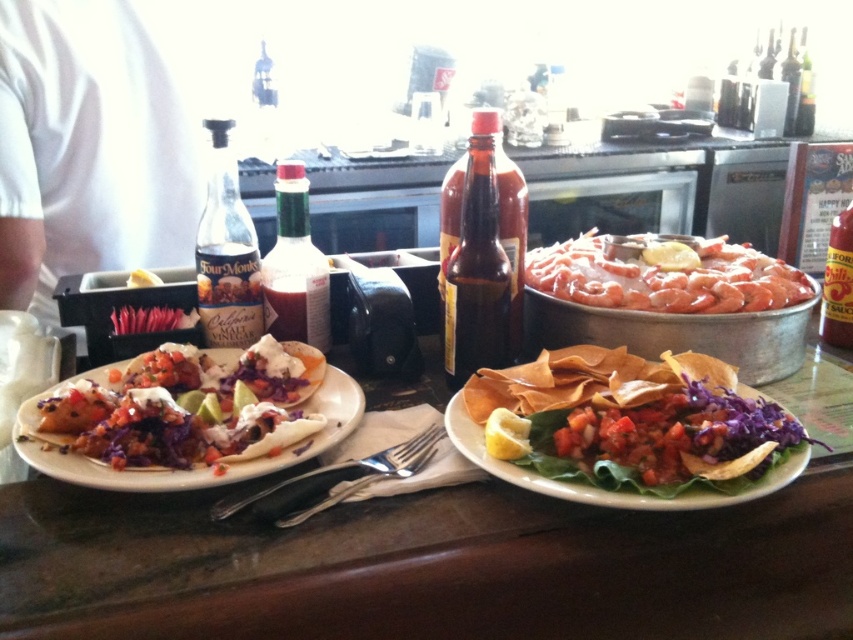
Is matte white tortilla at left in front of clear glass bottle at left?

That is True.

How much distance is there between matte white tortilla at left and clear glass bottle at left?

matte white tortilla at left and clear glass bottle at left are 13.68 centimeters apart from each other.

Who is more distant from viewer, (107, 413) or (219, 292)?

The point (219, 292) is more distant.

This screenshot has width=853, height=640. In order to click on matte white tortilla at left in this screenshot , I will do `click(186, 406)`.

Who is lower down, green glass bottle at center or translucent glass bottle at upper right?

green glass bottle at center

The image size is (853, 640). I want to click on green glass bottle at center, so click(294, 266).

Is point (305, 292) positioned before point (787, 68)?

Yes, point (305, 292) is in front of point (787, 68).

This screenshot has height=640, width=853. I want to click on green glass bottle at center, so click(x=294, y=266).

Which is in front, point (485, 202) or point (293, 232)?

Positioned in front is point (485, 202).

Which is above, brown glass bottle at center or green glass bottle at center?

brown glass bottle at center

Who is more forward, (x=515, y=211) or (x=294, y=292)?

Point (x=515, y=211) is more forward.

Identify the location of brown glass bottle at center. The height and width of the screenshot is (640, 853). (480, 253).